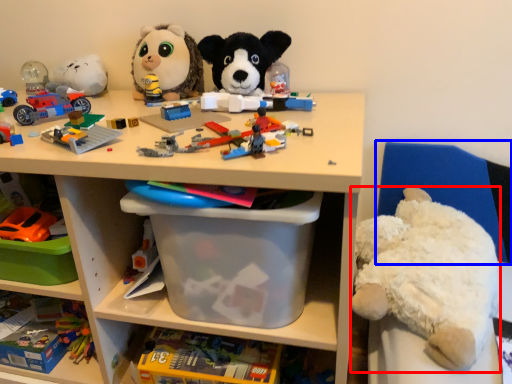
Question: Which object appears closest to the camera in this image, teddy bear (highlighted by a red box) or chair (highlighted by a blue box)?

Choices:
 (A) teddy bear
 (B) chair

Answer: (A)